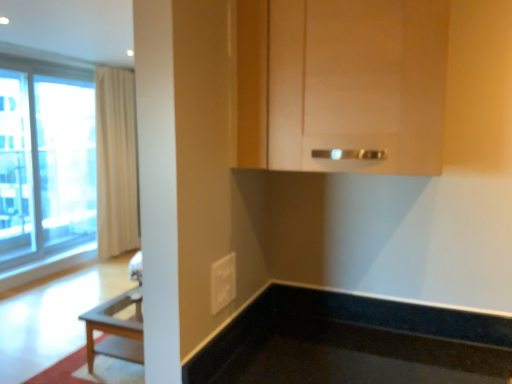
Question: Considering the relative positions of transparent glass screen door at left and beige fabric curtain at left in the image provided, is transparent glass screen door at left to the left or to the right of beige fabric curtain at left?

Choices:
 (A) left
 (B) right

Answer: (A)

Question: From a real-world perspective, is transparent glass screen door at left above or below beige fabric curtain at left?

Choices:
 (A) above
 (B) below

Answer: (A)

Question: Estimate the real-world distances between objects in this image. Which object is closer to the matte wood cabinet at upper center?

Choices:
 (A) transparent glass window at left
 (B) beige fabric curtain at left
 (C) white plastic electric outlet at lower center
 (D) transparent glass screen door at left

Answer: (C)

Question: Which object is positioned closest to the beige fabric curtain at left?

Choices:
 (A) matte wood cabinet at upper center
 (B) transparent glass window at left
 (C) transparent glass screen door at left
 (D) white plastic electric outlet at lower center

Answer: (B)